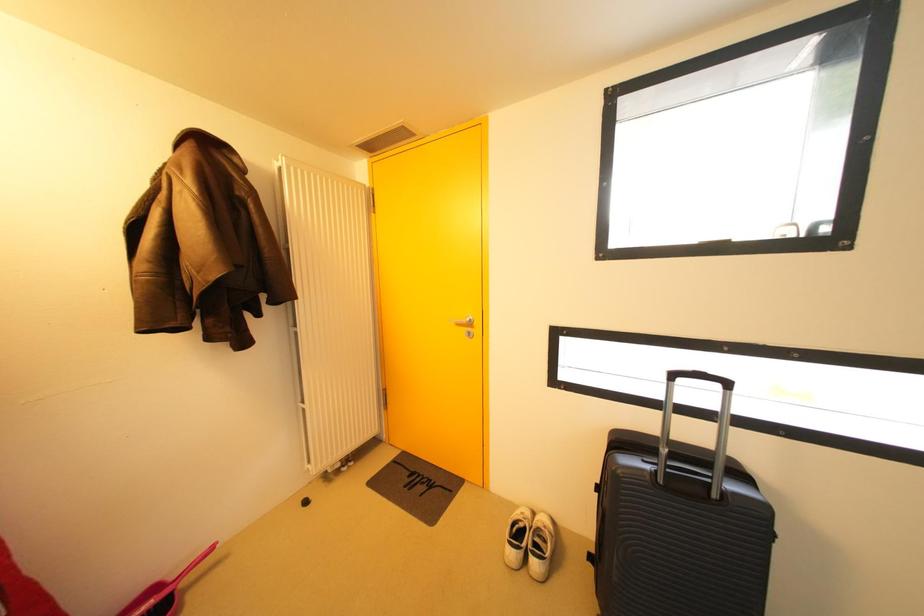
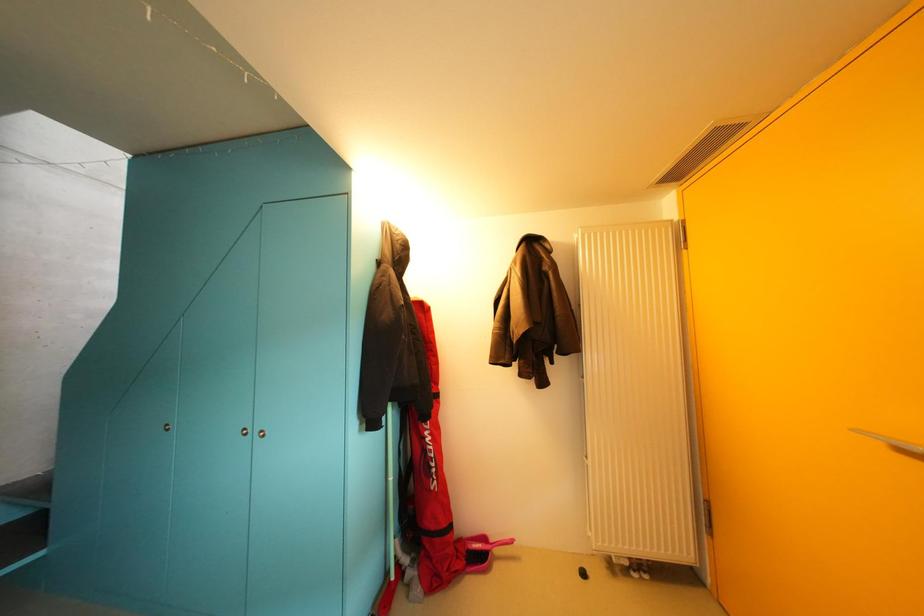
Question: The camera is either moving clockwise (left) or counter-clockwise (right) around the object. The first image is from the beginning of the video and the second image is from the end. Is the camera moving left or right when shooting the video?

Choices:
 (A) Left
 (B) Right

Answer: (B)